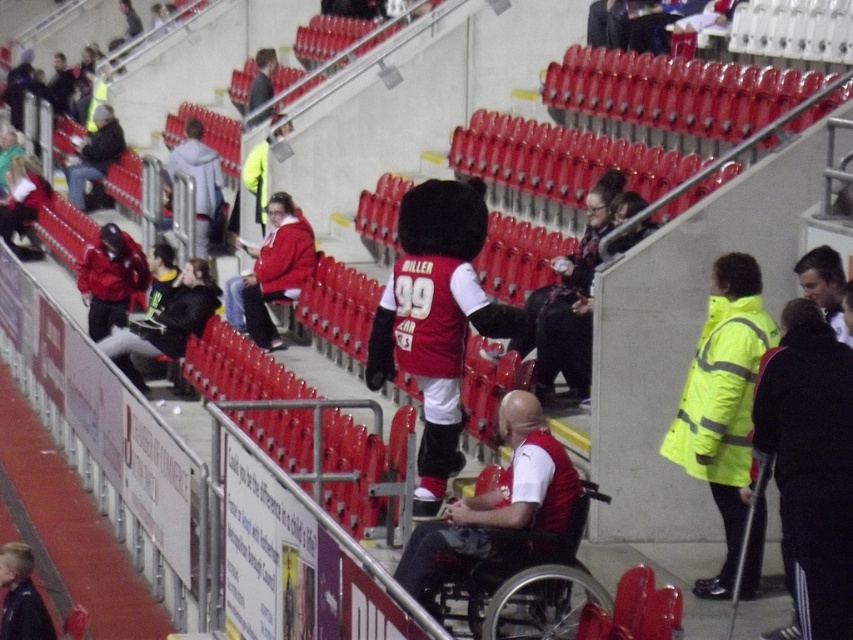
You are a spectator at the stadium and you see two jackets at the center of the image. The yellow reflective jacket at center and the matte black jacket at center. From your viewpoint, which jacket is positioned to the right?

The yellow reflective jacket at center is to the right of the matte black jacket at center.

You are a photographer positioned at the center of the stadium and want to take a photo of the light gray hoodie at upper left. Which direction should you turn your camera to capture it?

The light gray hoodie at upper left is located at point 0.283 on the x axis and 0.233 on the y axis, so to capture it, the photographer should aim the camera towards the upper left direction.